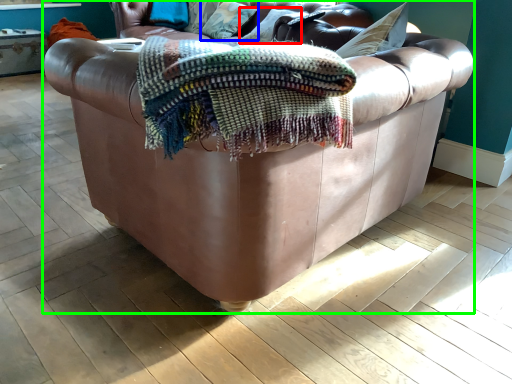
Question: Which object is positioned farthest from pillow (highlighted by a red box)? Select from pillow (highlighted by a blue box) and studio couch (highlighted by a green box).

Choices:
 (A) pillow
 (B) studio couch

Answer: (B)